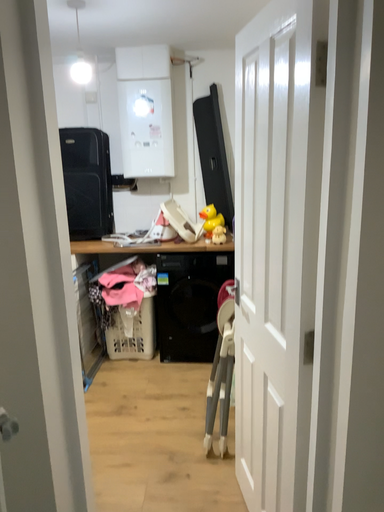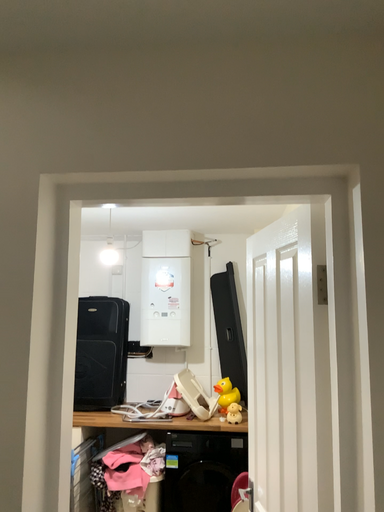
Question: Which way did the camera rotate in the video?

Choices:
 (A) rotated downward
 (B) rotated upward

Answer: (B)